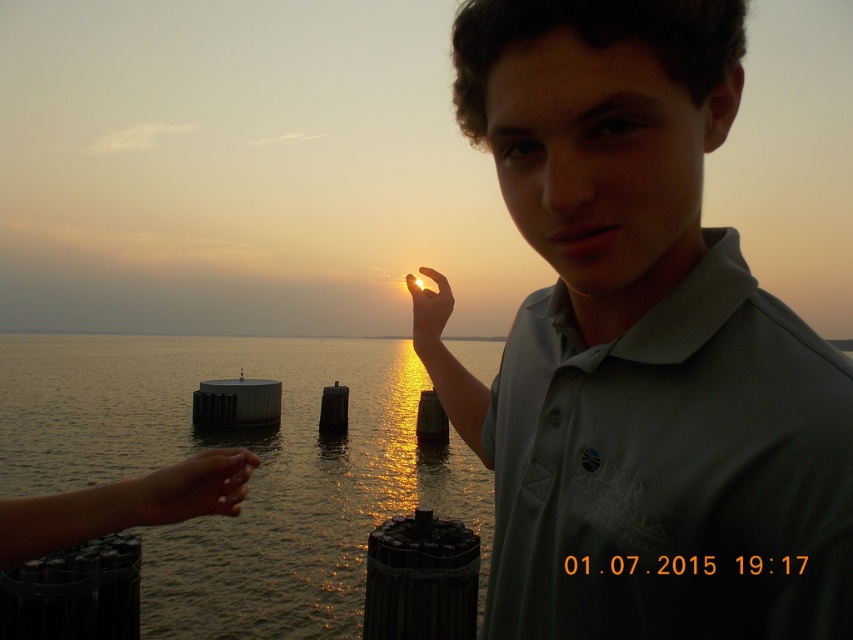
You are an artist trying to paint the sunset scene. You need to decide which object should be painted first based on their sizes. According to the scene, which object should you paint first, the matte green polo shirt at center or the glistening water at center?

The matte green polo shirt at center has a smaller size compared to glistening water at center, so you should paint the matte green polo shirt at center first as smaller details are often painted last, but since you need to paint first the larger one to establish the background, you should start with the glistening water at center.

You are a photographer trying to capture the sunset reflection on the glistening water at center. You notice the translucent golden hand at center is partially blocking the view. Which object is closer to the camera, making the hand appear in front of the water?

The translucent golden hand at center is closer to the camera than the glistening water at center because the glistening water at center is taller than the translucent golden hand at center, indicating the hand is in front.

You are standing on the dock and want to throw a small stone into the glistening water at center. If you can throw the stone 5 meters, will it reach the water?

The distance between you and the glistening water at center is 6.21 meters. Since your throw can only reach 5 meters, the stone will not reach the water.